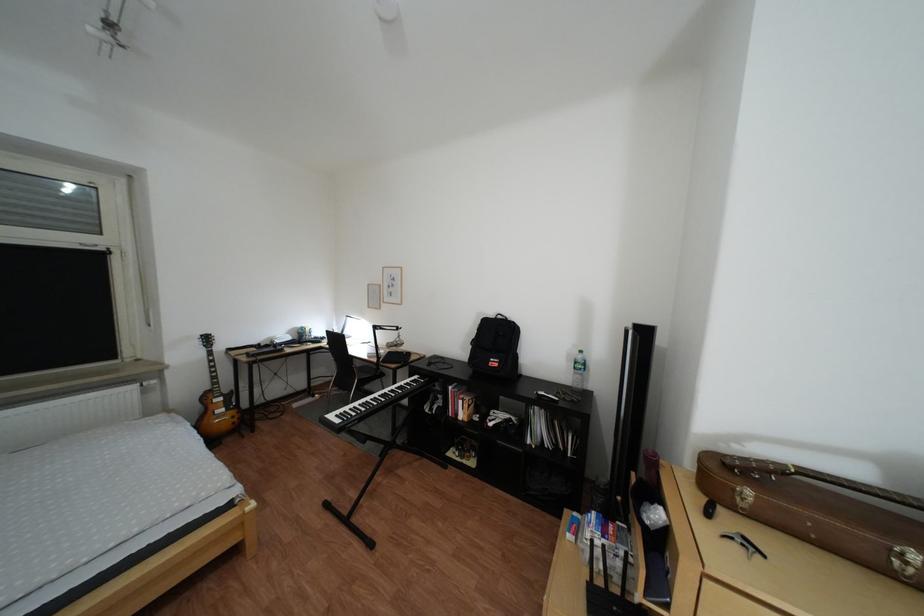
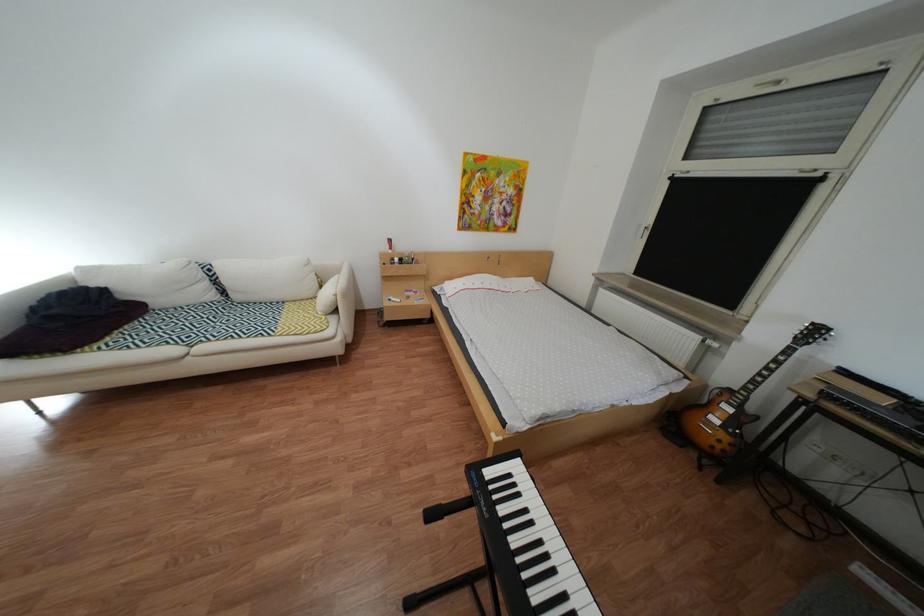
The point at (213, 344) is marked in the first image. Where is the corresponding point in the second image?

(810, 330)